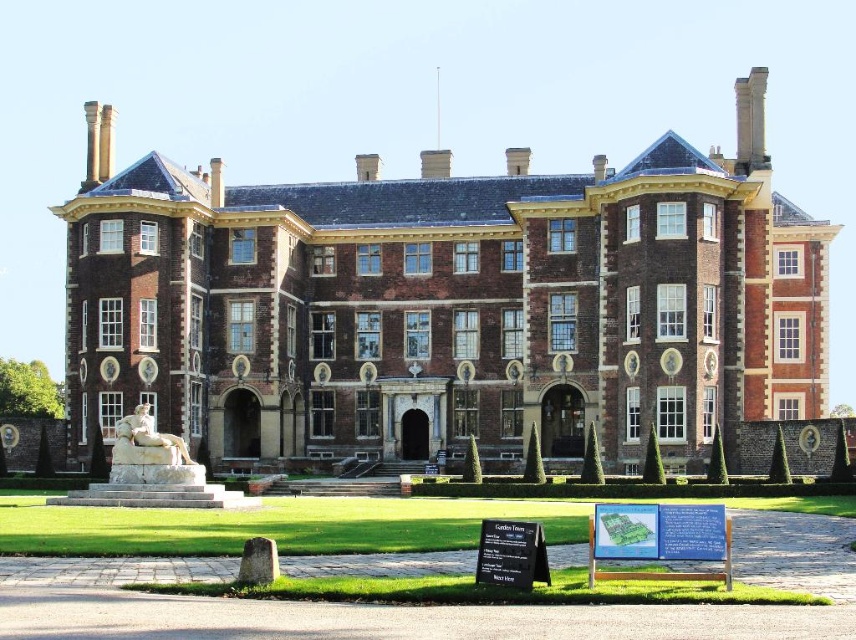
You are a photographer standing at a certain distance from the brown brick mansion at center. You want to capture a wide shot of the entire mansion in one frame. Considering the camera you are using has a standard lens with a 50mm focal length, which is suitable for capturing scenes up to 250 feet away, can you achieve this without moving closer?

The brown brick mansion at center is 247.63 feet from the camera. Since the camera lens can capture scenes up to 250 feet away, you can achieve the wide shot without moving closer.

You are a photographer planning to take a wide shot of the brown brick mansion at center and the white marble statue at lower left. Based on their sizes, which object should you focus on to ensure both are fully captured in the frame?

The brown brick mansion at center might be wider than the white marble statue at lower left, so focusing on the mansion would ensure both are fully captured in the frame as it likely occupies more width.

You are standing in a garden and see the brown brick mansion at center and the white marble statue at lower left. Which object is located to the left of the other?

The white marble statue at lower left is located to the left of the brown brick mansion at center.